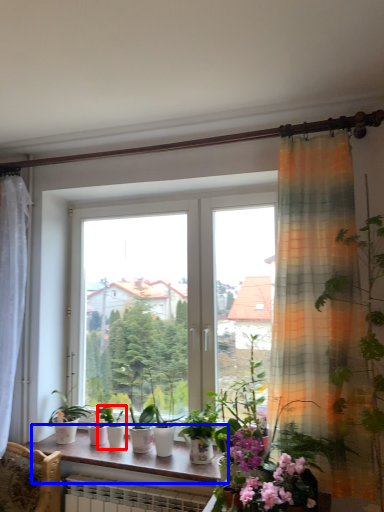
Question: Among these objects, which one is nearest to the camera, houseplant (highlighted by a red box) or window sill (highlighted by a blue box)?

Choices:
 (A) houseplant
 (B) window sill

Answer: (B)